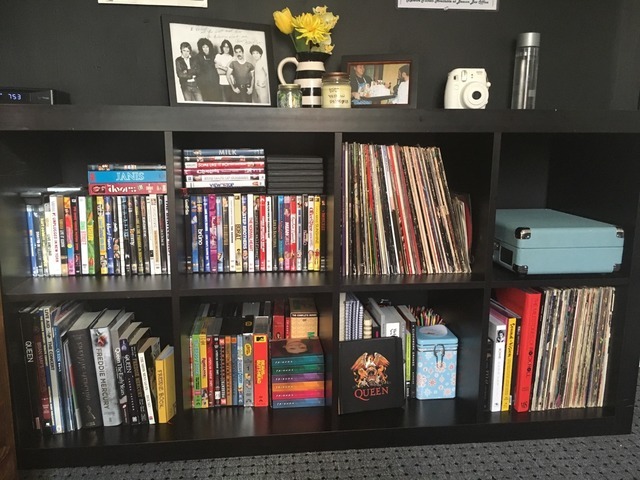
I want to click on floor, so [x=504, y=459].